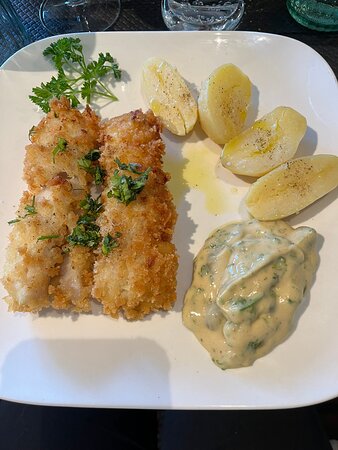
The height and width of the screenshot is (450, 338). Find the location of `plate`. plate is located at coordinates 297,67.